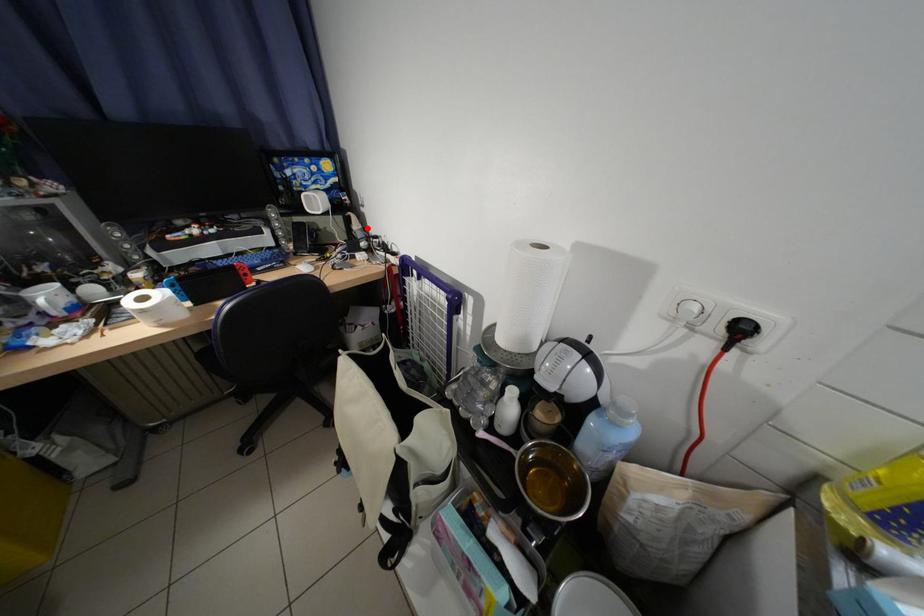
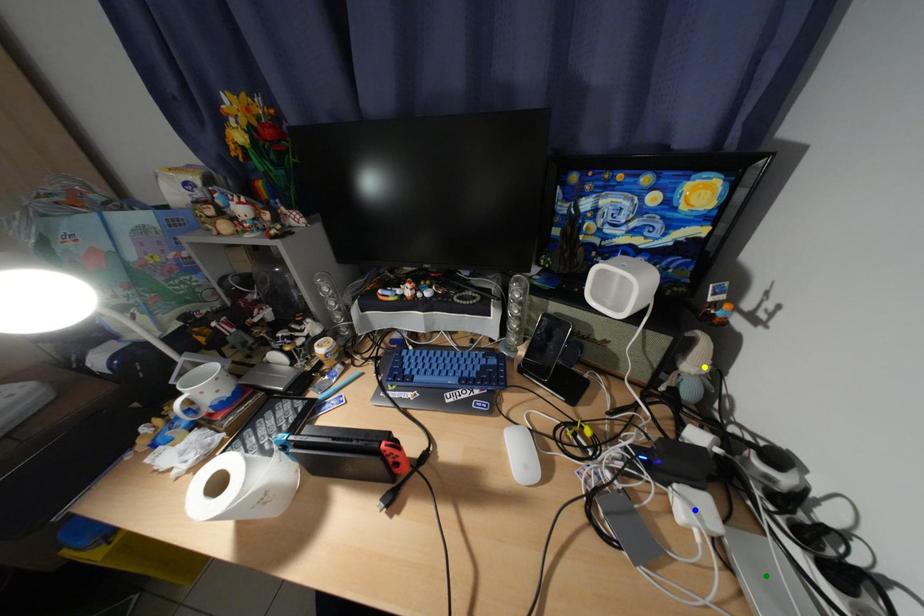
Question: I am providing you with two images of the same scene from different viewpoints. A red point is marked on the first image. You are given multiple points on the second image. Can you choose the point in image 2 that corresponds to the point in image 1?

Choices:
 (A) yellow point
 (B) blue point
 (C) green point

Answer: (A)